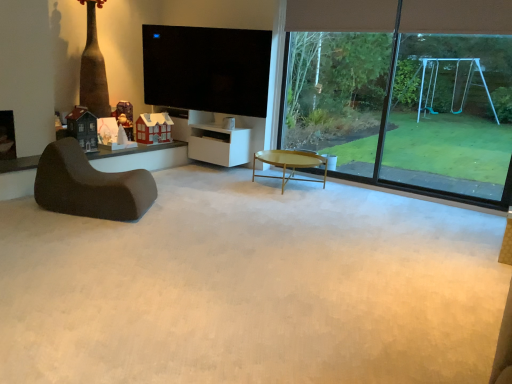
At what (x,y) coordinates should I click in order to perform the action: click on vacant region below gold metallic coffee table at center (from a real-world perspective). Please return your answer as a coordinate pair (x, y). The width and height of the screenshot is (512, 384). Looking at the image, I should click on (294, 183).